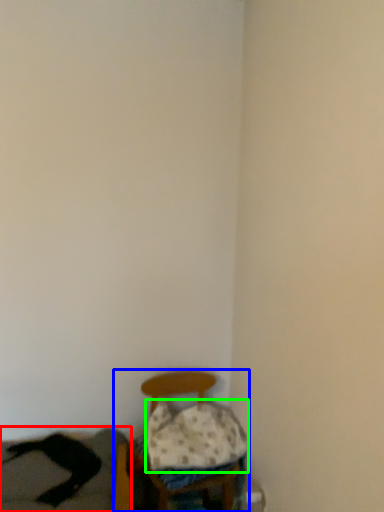
Question: Based on their relative distances, which object is nearer to couch (highlighted by a red box)? Choose from furniture (highlighted by a blue box) and pillow (highlighted by a green box).

Choices:
 (A) furniture
 (B) pillow

Answer: (A)